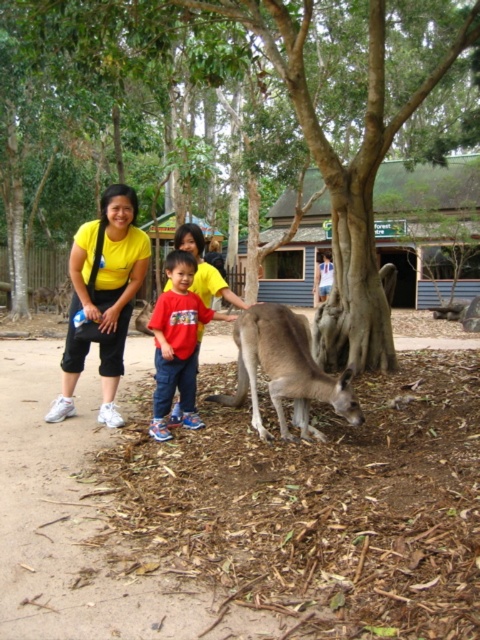
Question: Which of the following is the farthest from the observer?

Choices:
 (A) (81, 276)
 (B) (172, 330)
 (C) (339, 401)

Answer: (A)

Question: Where is brown textured tree at center located in relation to gray furry kangaroo at lower center in the image?

Choices:
 (A) above
 (B) below

Answer: (A)

Question: Which point is farther from the camera taking this photo?

Choices:
 (A) (184, 337)
 (B) (218, 3)
 (C) (120, 285)
 (D) (300, 324)

Answer: (B)

Question: Which point is closer to the camera taking this photo?

Choices:
 (A) (14, 237)
 (B) (78, 339)

Answer: (B)

Question: Does yellow matte shirt at center appear over gray furry kangaroo at lower center?

Choices:
 (A) no
 (B) yes

Answer: (B)

Question: Can you confirm if brown textured tree at center is positioned to the left of yellow matte shirt at center?

Choices:
 (A) no
 (B) yes

Answer: (A)